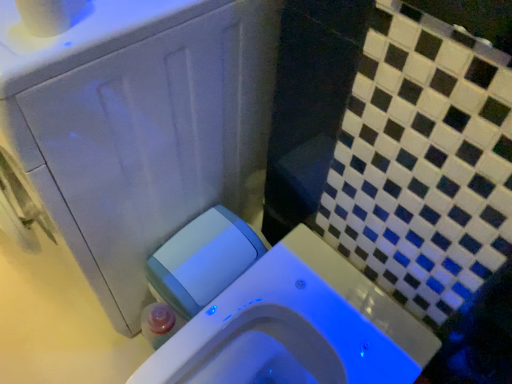
In order to click on blank space above white glossy toilet at center (from a real-world perspective) in this screenshot , I will do `click(314, 311)`.